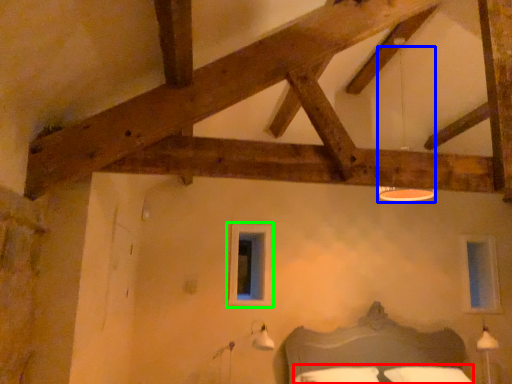
Question: Based on their relative distances, which object is farther from bedding (highlighted by a red box)? Choose from lamp (highlighted by a blue box) and window (highlighted by a green box).

Choices:
 (A) lamp
 (B) window

Answer: (A)